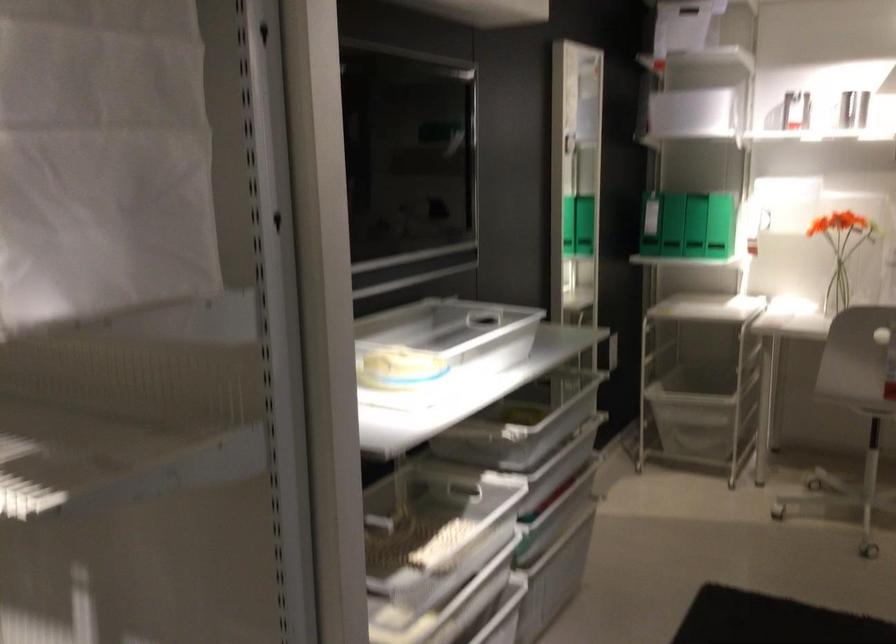
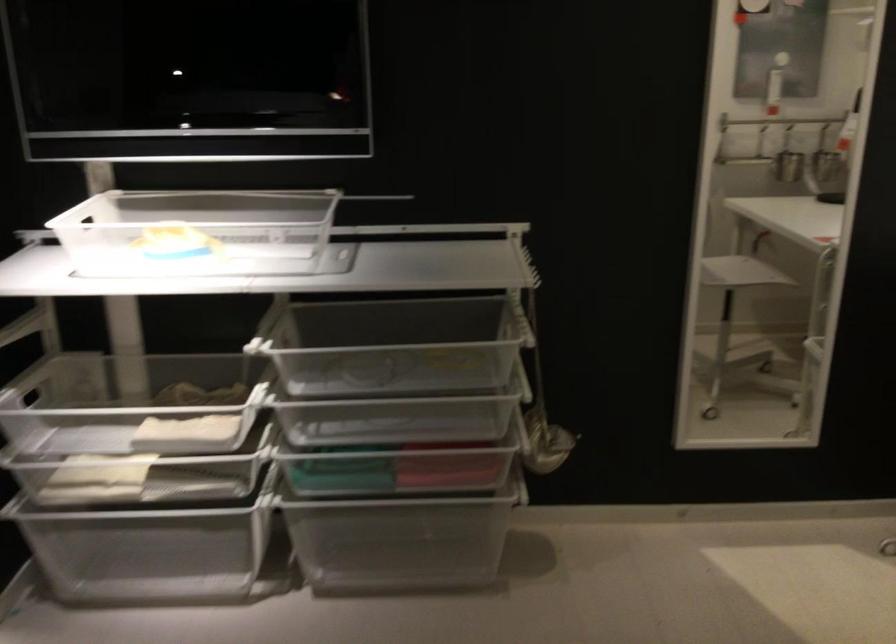
In the second image, find the point that corresponds to point 401,328 in the first image.

(197, 232)